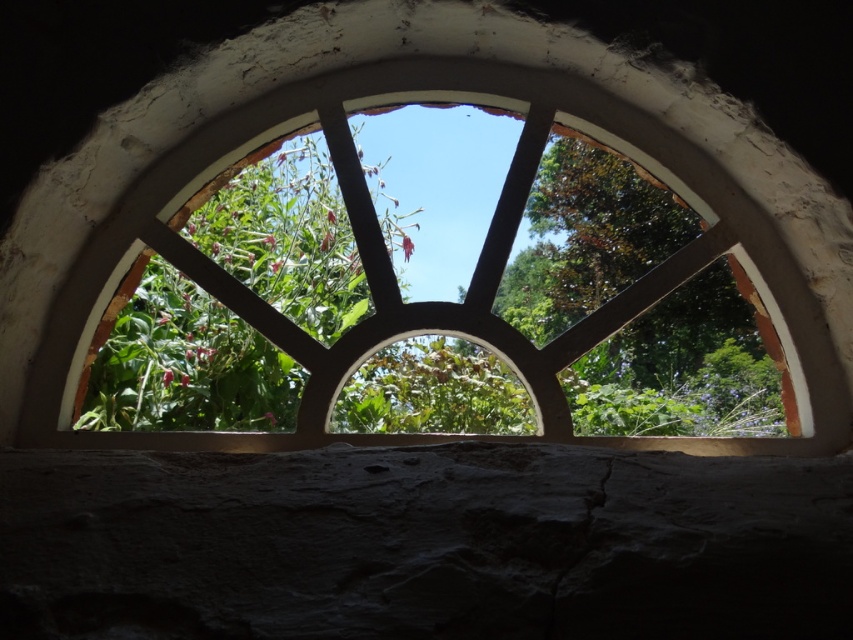
Is point (663, 38) in front of point (548, 292)?

That is True.

Locate an element on the screen. This screenshot has width=853, height=640. wooden at center is located at coordinates (469, 58).

Identify the location of wooden at center. (469, 58).